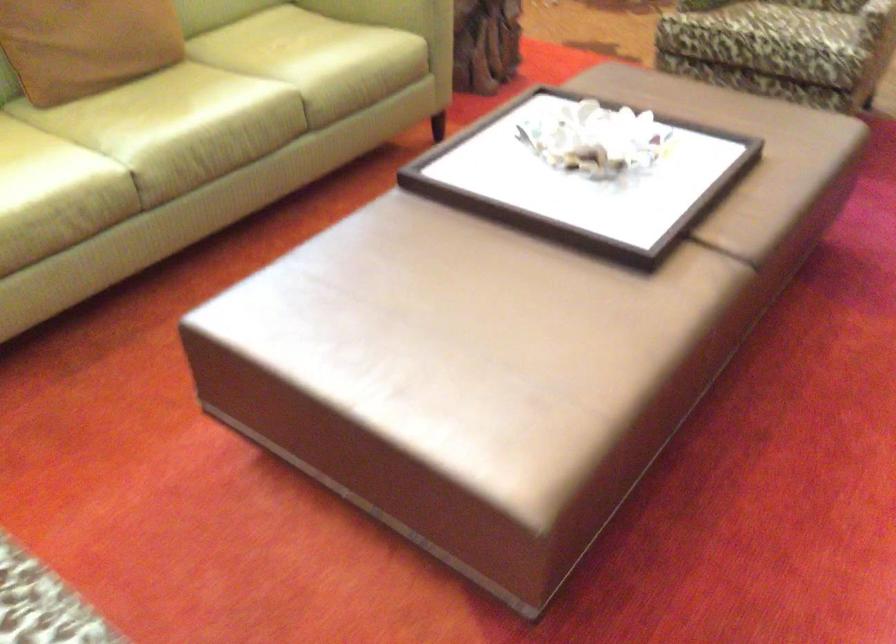
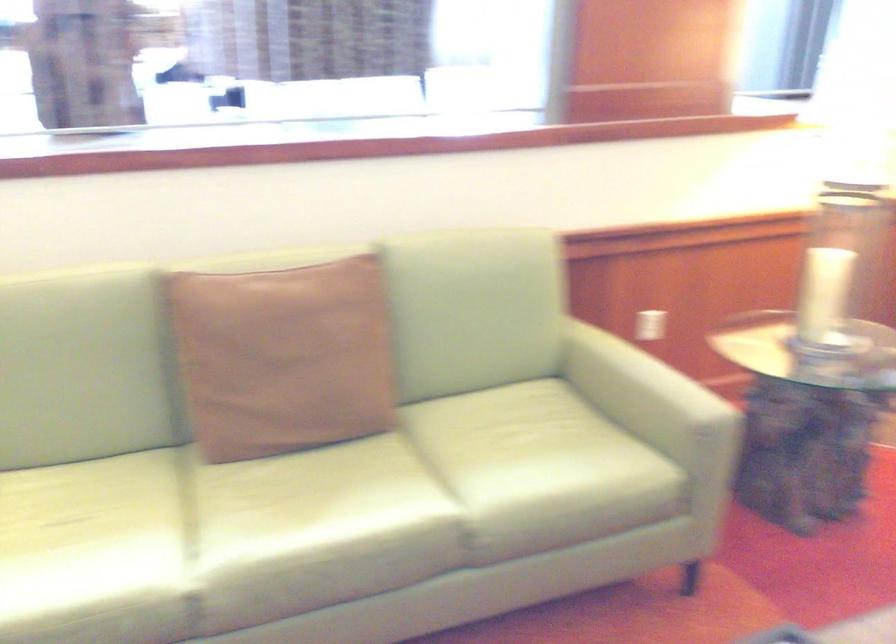
The point at (149, 108) is marked in the first image. Where is the corresponding point in the second image?

(299, 498)